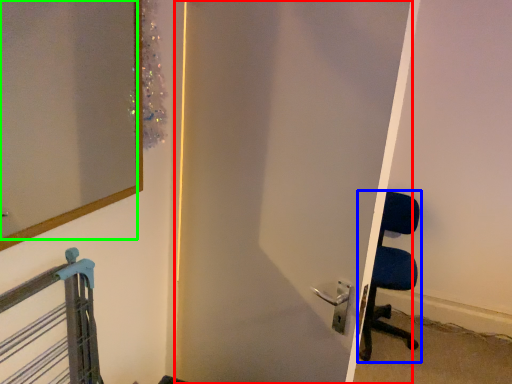
Question: Which is nearer to the door (highlighted by a red box)? chair (highlighted by a blue box) or mirror (highlighted by a green box).

Choices:
 (A) chair
 (B) mirror

Answer: (B)